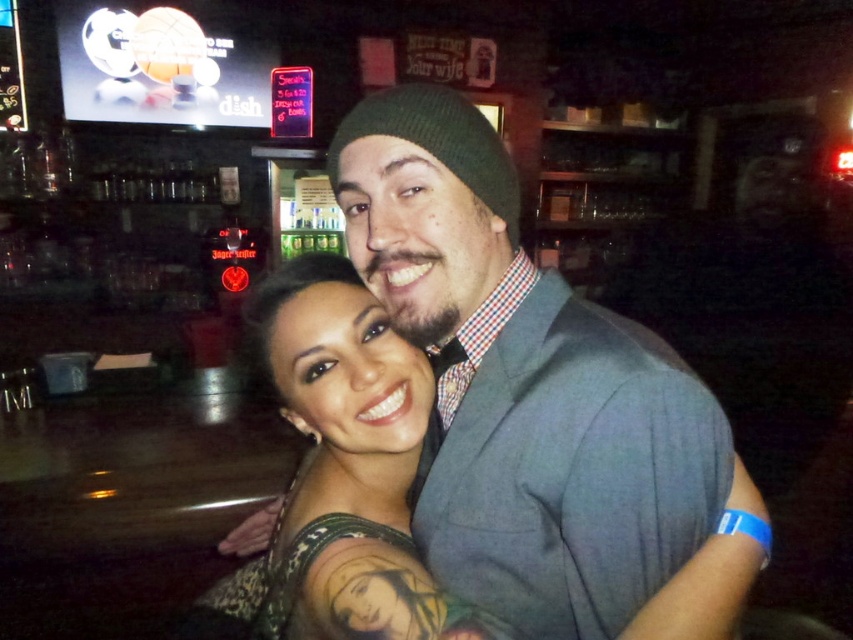
The height and width of the screenshot is (640, 853). Identify the location of matte gray suit at center. (540, 401).

Between point (618, 429) and point (358, 481), which one is positioned behind?

The point (358, 481) is behind.

Find the location of a particular element. The width and height of the screenshot is (853, 640). matte gray suit at center is located at coordinates (540, 401).